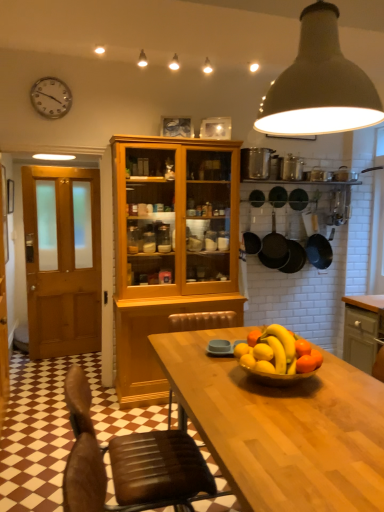
What are the coordinates of `shiny golden bowl at center` in the screenshot? It's located at (278, 356).

Find the location of a particular element. This screenshot has height=512, width=384. silver metallic clock at upper left is located at coordinates (51, 97).

The height and width of the screenshot is (512, 384). Identify the location of clock above the wooden door at left (from the image's perspective). (51, 97).

Does point (83, 198) appear closer or farther from the camera than point (43, 93)?

Point (83, 198) is positioned farther from the camera compared to point (43, 93).

Between wooden door at left and silver metallic clock at upper left, which one is positioned in front?

wooden door at left is more forward.

From a real-world perspective, who is located lower, shiny golden bowl at center or silver metallic clock at upper left?

shiny golden bowl at center, from a real-world perspective.

In terms of height, does shiny golden bowl at center look taller or shorter compared to silver metallic clock at upper left?

Clearly, shiny golden bowl at center is shorter compared to silver metallic clock at upper left.

In the image, is shiny golden bowl at center positioned in front of or behind silver metallic clock at upper left?

shiny golden bowl at center is in front of silver metallic clock at upper left.

How different are the orientations of shiny golden bowl at center and silver metallic clock at upper left in degrees?

87 degrees separate the facing orientations of shiny golden bowl at center and silver metallic clock at upper left.

Considering the positions of objects white matte pendant light at upper center and shiny golden bowl at center in the image provided, who is behind, white matte pendant light at upper center or shiny golden bowl at center?

Positioned behind is shiny golden bowl at center.

Which point is more forward, (303, 78) or (308, 350)?

The point (303, 78) is more forward.

From the image's perspective, does white matte pendant light at upper center appear higher than shiny golden bowl at center?

Correct, white matte pendant light at upper center appears higher than shiny golden bowl at center in the image.

Does silver metallic clock at upper left lie in front of white matte pendant light at upper center?

No, it is behind white matte pendant light at upper center.

Are silver metallic clock at upper left and white matte pendant light at upper center located far from each other?

Absolutely, silver metallic clock at upper left is distant from white matte pendant light at upper center.

Is silver metallic clock at upper left not within white matte pendant light at upper center?

Yes.

Find the location of a particular element. The image size is (384, 512). light located in front of the silver metallic clock at upper left is located at coordinates (320, 85).

Is wooden door at left at the back of shiny golden bowl at center?

No, shiny golden bowl at center is not facing the opposite direction of wooden door at left.

Considering the sizes of objects shiny golden bowl at center and wooden door at left in the image provided, who is smaller, shiny golden bowl at center or wooden door at left?

Smaller between the two is shiny golden bowl at center.

Considering the sizes of objects shiny golden bowl at center and wooden door at left in the image provided, who is wider, shiny golden bowl at center or wooden door at left?

shiny golden bowl at center.

Is matte gray cabinet at right positioned far away from silver metallic clock at upper left?

Yes, matte gray cabinet at right is far from silver metallic clock at upper left.

In terms of width, does matte gray cabinet at right look wider or thinner when compared to silver metallic clock at upper left?

In the image, matte gray cabinet at right appears to be wider than silver metallic clock at upper left.

Locate an element on the screen. This screenshot has width=384, height=512. clock that appears behind the matte gray cabinet at right is located at coordinates (51, 97).

Which object is closer to the camera taking this photo, matte gray cabinet at right or white matte pendant light at upper center?

white matte pendant light at upper center is more forward.

From a real-world perspective, is matte gray cabinet at right positioned under white matte pendant light at upper center based on gravity?

Indeed, from a real-world perspective, matte gray cabinet at right is positioned beneath white matte pendant light at upper center.

Based on their sizes in the image, would you say matte gray cabinet at right is bigger or smaller than white matte pendant light at upper center?

Clearly, matte gray cabinet at right is larger in size than white matte pendant light at upper center.

Locate an element on the screen. The image size is (384, 512). clock on the right of wooden door at left is located at coordinates (51, 97).

The width and height of the screenshot is (384, 512). In order to click on clock above the shiny golden bowl at center (from the image's perspective) in this screenshot , I will do `click(51, 97)`.

Based on their spatial positions, is wooden door at left or brown leather chair at lower center further from shiny golden bowl at center?

wooden door at left.

Considering their positions, is white matte pendant light at upper center positioned further to brown leather chair at lower center than matte gray cabinet at right?

matte gray cabinet at right is further to brown leather chair at lower center.

Which object lies nearer to the anchor point wooden door at left, matte gray cabinet at right or shiny golden bowl at center?

matte gray cabinet at right is positioned closer to the anchor wooden door at left.

When comparing their distances from white matte pendant light at upper center, does brown leather chair at lower center or matte gray cabinet at right seem closer?

brown leather chair at lower center.

Looking at this image, based on their spatial positions, is matte gray cabinet at right or silver metallic clock at upper left further from wooden door at left?

Among the two, matte gray cabinet at right is located further to wooden door at left.

Looking at the image, which one is located closer to white matte pendant light at upper center, brown leather chair at lower center or wooden door at left?

The object closer to white matte pendant light at upper center is brown leather chair at lower center.

Estimate the real-world distances between objects in this image. Which object is closer to matte gray cabinet at right, brown leather chair at lower center or wooden door at left?

brown leather chair at lower center.

Based on their spatial positions, is silver metallic clock at upper left or matte gray cabinet at right closer to wooden door at left?

silver metallic clock at upper left lies closer to wooden door at left than the other object.

The image size is (384, 512). Identify the location of fruit dish between brown leather chair at lower center and wooden door at left in the front-back direction. (278, 356).

Where is `door between brown leather chair at lower center and silver metallic clock at upper left in the front-back direction`? Image resolution: width=384 pixels, height=512 pixels. door between brown leather chair at lower center and silver metallic clock at upper left in the front-back direction is located at coordinates (62, 259).

This screenshot has height=512, width=384. Identify the location of chair between white matte pendant light at upper center and silver metallic clock at upper left along the z-axis. (130, 464).

What are the coordinates of `fruit dish between white matte pendant light at upper center and wooden door at left along the z-axis` in the screenshot? It's located at (278, 356).